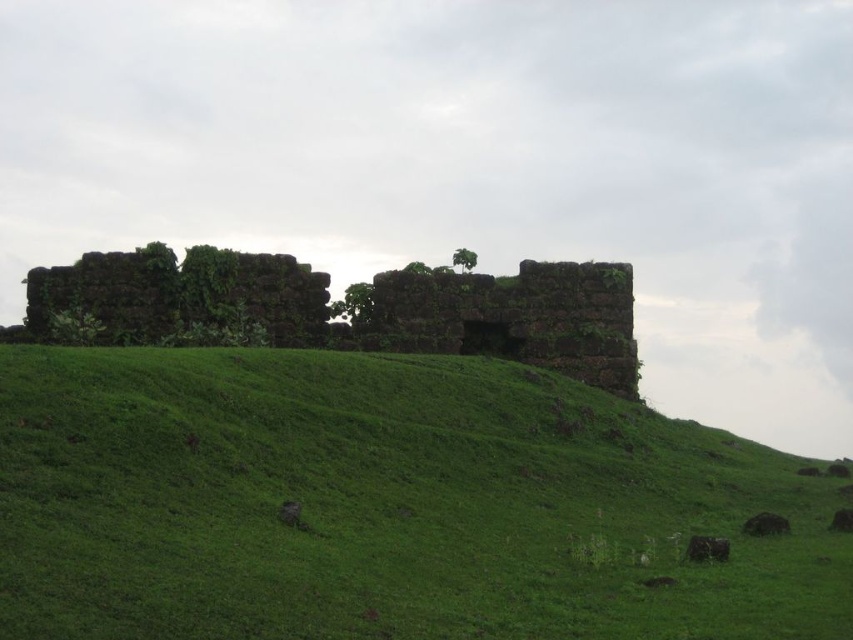
Is point (259, 481) positioned after point (534, 305)?

No.

In order to click on green grassy hillside at center in this screenshot , I will do `click(386, 504)`.